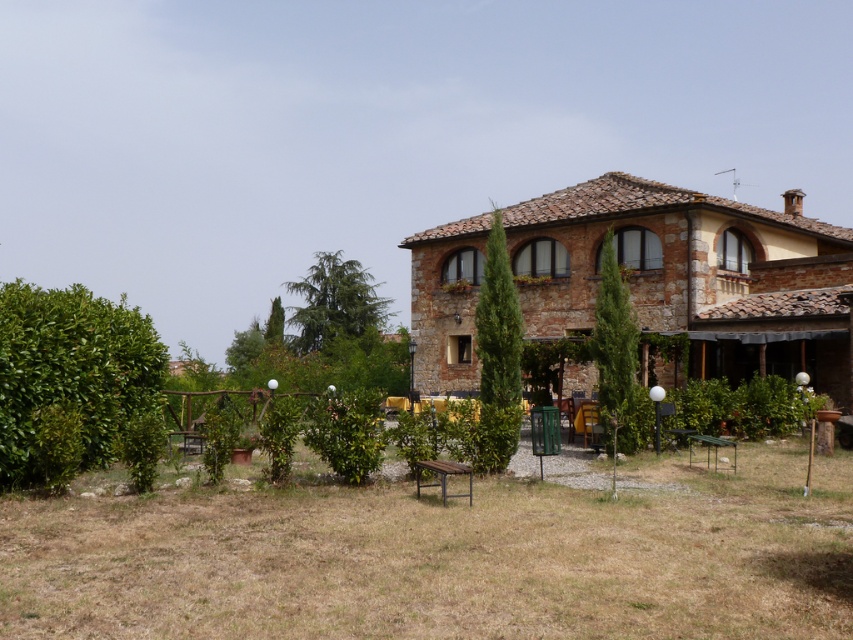
You are planning to place a new garden statue that is 1.5 meters tall in the scene. Considering the sizes of the brown wooden bench at center and the rustic stone villa at center, which object would be more appropriate to place the statue next to for proportional harmony?

The brown wooden bench at center is smaller than the rustic stone villa at center, so placing the statue next to the brown wooden bench at center would create better proportional harmony since the statue is also relatively small in size.